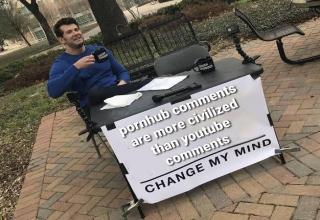
Locate an element on the screen. The height and width of the screenshot is (220, 320). table legs is located at coordinates (139, 210), (282, 157).